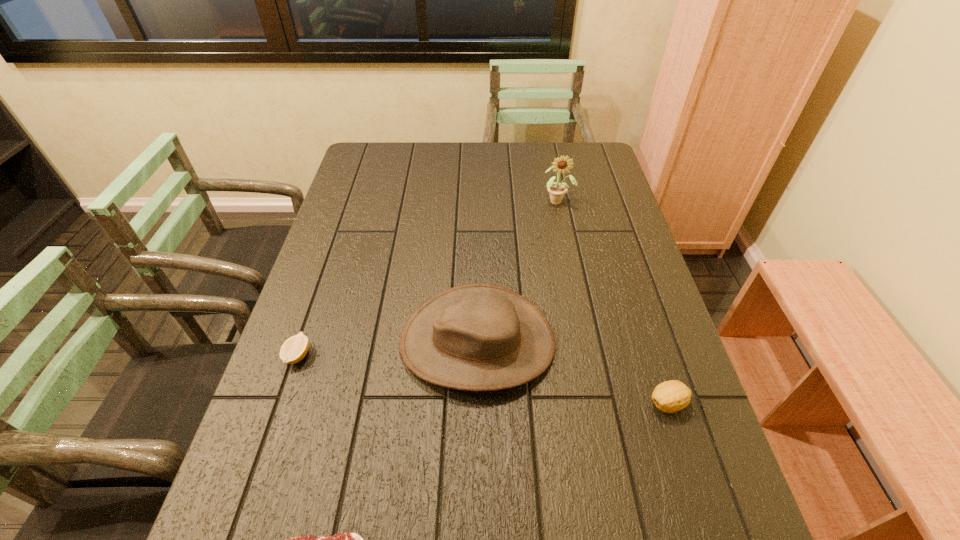
Identify the location of vacant area situated 0.200m at the stem end of the third shortest object. (554, 403).

Locate an element on the screen. Image resolution: width=960 pixels, height=540 pixels. vacant area situated 0.370m at the stem end of the third shortest object is located at coordinates (475, 403).

Locate an element on the screen. This screenshot has height=540, width=960. vacant area located 0.160m on the back of the left lemon is located at coordinates (320, 291).

Identify the location of object present at the left edge. This screenshot has height=540, width=960. (294, 349).

I want to click on sunflower located at the right edge, so click(557, 190).

Locate an element on the screen. The image size is (960, 540). lemon situated at the right edge is located at coordinates (671, 396).

The height and width of the screenshot is (540, 960). I want to click on vacant space at the far edge, so click(x=471, y=144).

In the image, there is a desktop. Identify the location of vacant space at the left edge. (359, 204).

This screenshot has height=540, width=960. I want to click on free space at the right edge, so click(684, 529).

Find the location of a particular element. The width and height of the screenshot is (960, 540). free space at the far right corner of the desktop is located at coordinates (596, 176).